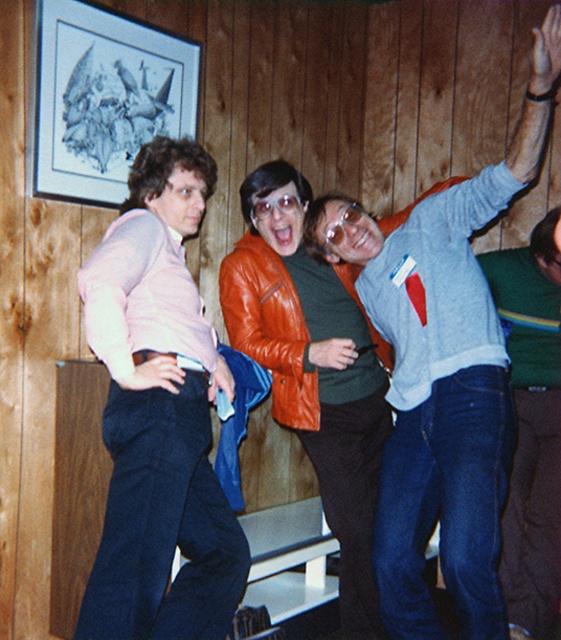
You are a photographer trying to capture a candid shot of the leather jacket at center and the blue jeans at lower right. The camera you are using has a minimum focus distance of 25 inches. Can you focus on both subjects simultaneously without moving the camera?

The leather jacket at center and the blue jeans at lower right are 25.80 inches apart. Since the distance between them is slightly more than the camera minimum focus distance of 25 inches, the camera can focus on both subjects simultaneously without moving.

You are organizing a charity clothing drive and need to determine if the matte pink sweater at left can fit into a donation box that is the same size as the leather jacket at center. Based on the scene description, will it fit?

The matte pink sweater at left has a smaller size compared to the leather jacket at center, so it will fit into the donation box designed for the leather jacket at center.